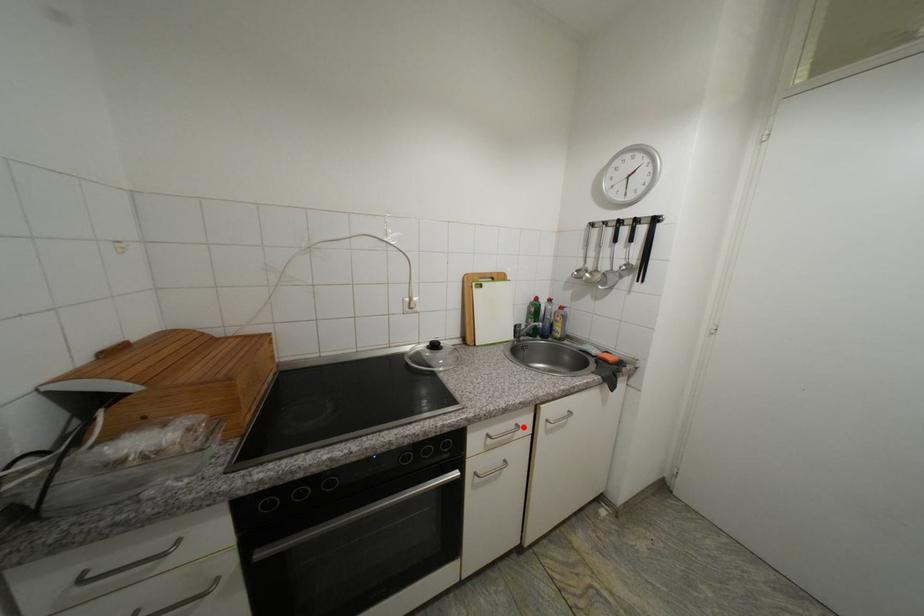
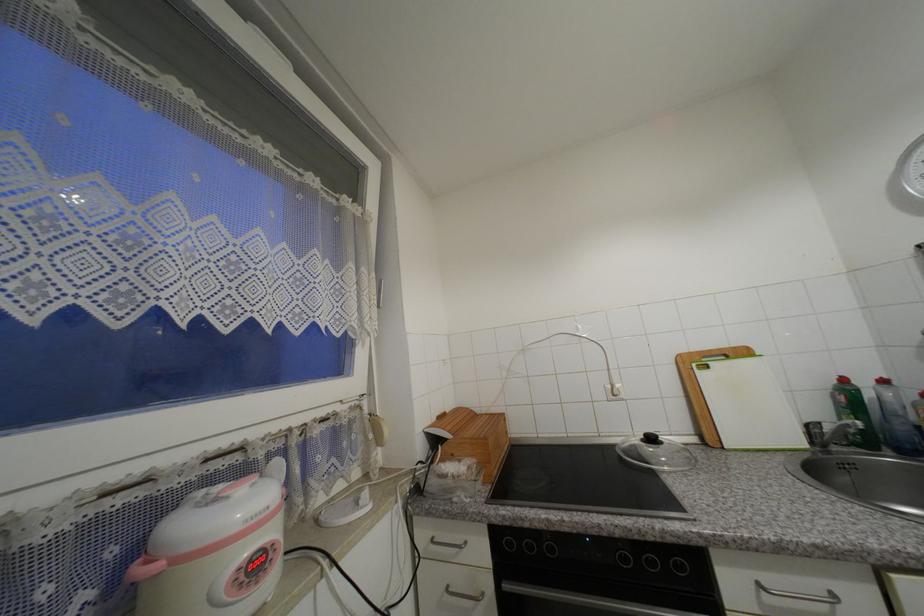
Find the pixel in the second image that matches the highlighted location in the first image.

(840, 597)